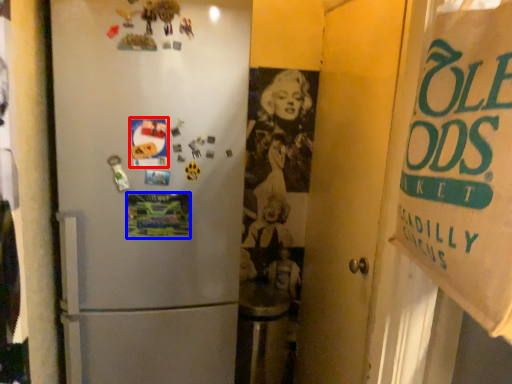
Question: Among these objects, which one is farthest to the camera, postcard (highlighted by a red box) or postcard (highlighted by a blue box)?

Choices:
 (A) postcard
 (B) postcard

Answer: (B)